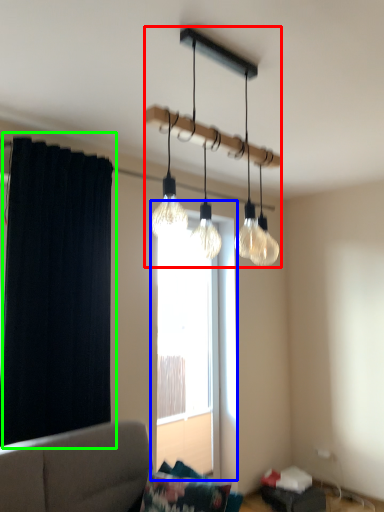
Question: Which object is the closest to the lamp (highlighted by a red box)? Choose among these: window (highlighted by a blue box) or curtain (highlighted by a green box).

Choices:
 (A) window
 (B) curtain

Answer: (B)